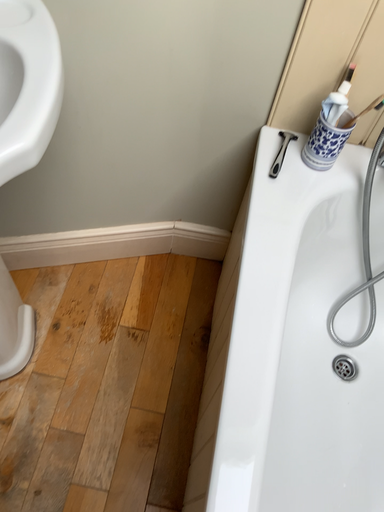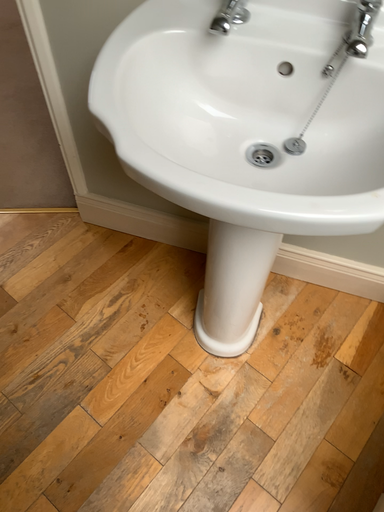
Question: How did the camera likely rotate when shooting the video?

Choices:
 (A) rotated left
 (B) rotated right

Answer: (A)